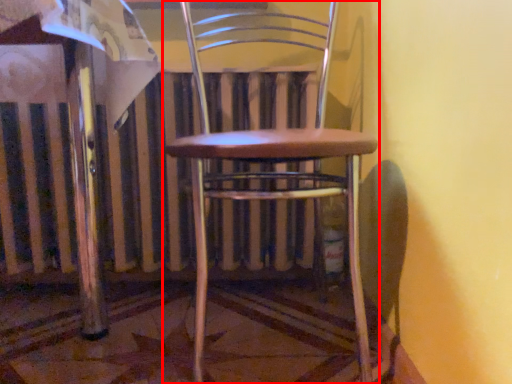
Question: Observing the image, what is the correct spatial positioning of chair (annotated by the red box) in reference to radiator?

Choices:
 (A) left
 (B) right

Answer: (B)